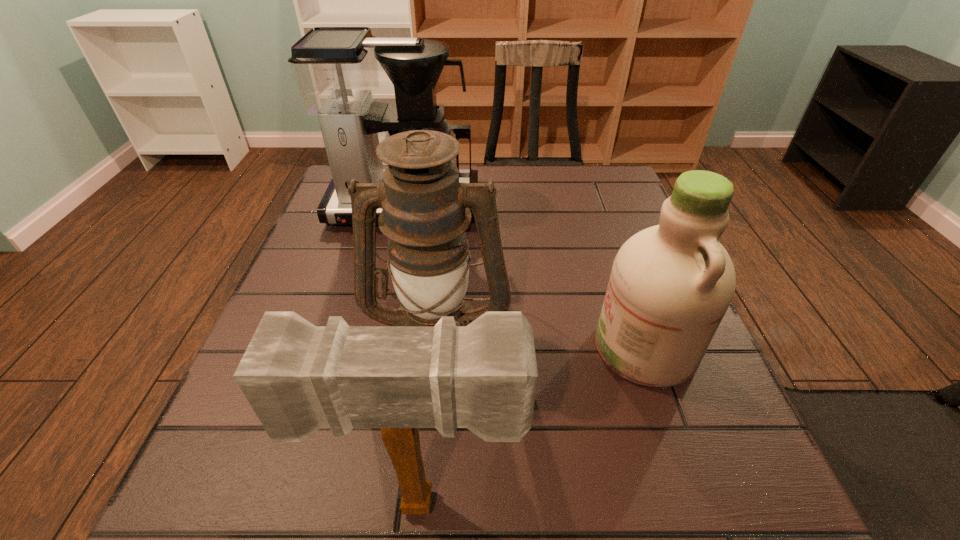
At what (x,y) coordinates should I click in order to perform the action: click on object located at the far edge. Please return your answer as a coordinate pair (x, y). Looking at the image, I should click on (335, 69).

At what (x,y) coordinates should I click in order to perform the action: click on object positioned at the near edge. Please return your answer as a coordinate pair (x, y). This screenshot has height=540, width=960. Looking at the image, I should click on (298, 377).

Find the location of a particular element. The width and height of the screenshot is (960, 540). object located at the left edge is located at coordinates (335, 69).

This screenshot has height=540, width=960. I want to click on object that is at the right edge, so click(x=670, y=286).

The image size is (960, 540). What are the coordinates of `object located in the far left corner section of the desktop` in the screenshot? It's located at (335, 69).

Find the location of a particular element. vacant space at the far edge of the desktop is located at coordinates (514, 172).

Locate an element on the screen. This screenshot has width=960, height=540. blank area at the near edge is located at coordinates (629, 525).

In the image, there is a desktop. Identify the location of vacant space at the right edge. This screenshot has width=960, height=540. tap(692, 461).

Locate an element on the screen. blank area at the far right corner is located at coordinates (623, 210).

The height and width of the screenshot is (540, 960). Find the location of `empty space that is in between the rightmost object and the oil lamp`. empty space that is in between the rightmost object and the oil lamp is located at coordinates (541, 343).